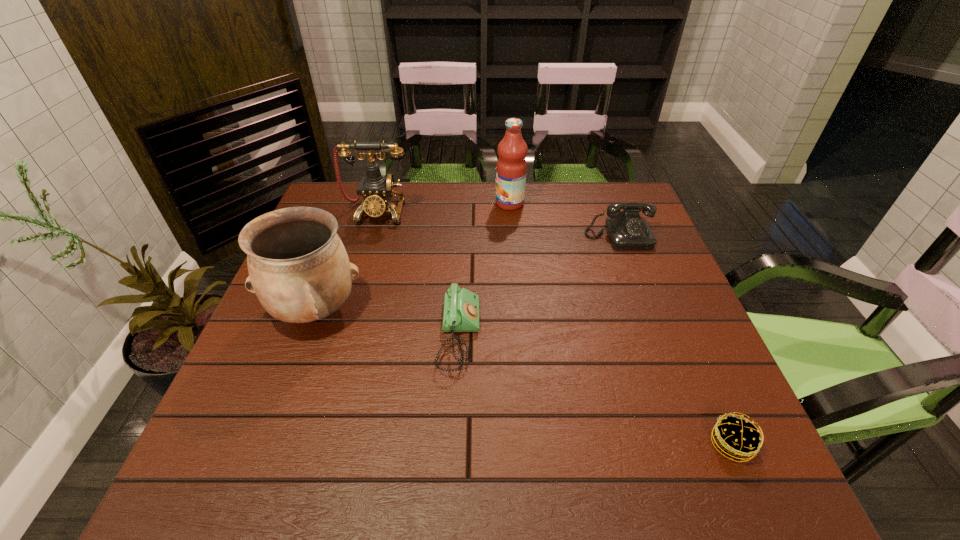
Identify the location of free space located 0.230m on the front label of the fourth object from left to right. (422, 204).

At what (x,y) coordinates should I click in order to perform the action: click on vacant space located 0.330m on the back of the urn. Please return your answer as a coordinate pair (x, y). Looking at the image, I should click on (353, 208).

Locate an element on the screen. vacant area located on the front of the leftmost telephone, featuring the rotary dial is located at coordinates [x=359, y=281].

Locate an element on the screen. The image size is (960, 540). blank area located on the dial of the second tallest telephone is located at coordinates (648, 314).

Find the location of `free location located 0.070m on the dial of the second telephone from right to left`. free location located 0.070m on the dial of the second telephone from right to left is located at coordinates (510, 335).

Where is `free spot located 0.380m on the back of the nearest object`? free spot located 0.380m on the back of the nearest object is located at coordinates (662, 286).

This screenshot has width=960, height=540. I want to click on fruit juice that is positioned at the far edge, so click(x=511, y=169).

Where is `object positioned at the near edge`? This screenshot has width=960, height=540. object positioned at the near edge is located at coordinates [x=738, y=438].

Where is `urn located in the left edge section of the desktop`? urn located in the left edge section of the desktop is located at coordinates (299, 269).

Where is `telephone that is positioned at the left edge`? telephone that is positioned at the left edge is located at coordinates (376, 190).